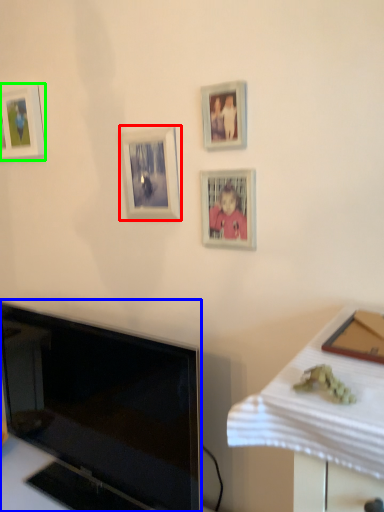
Question: Estimate the real-world distances between objects in this image. Which object is farther from picture frame (highlighted by a red box), television (highlighted by a blue box) or picture frame (highlighted by a green box)?

Choices:
 (A) television
 (B) picture frame

Answer: (A)